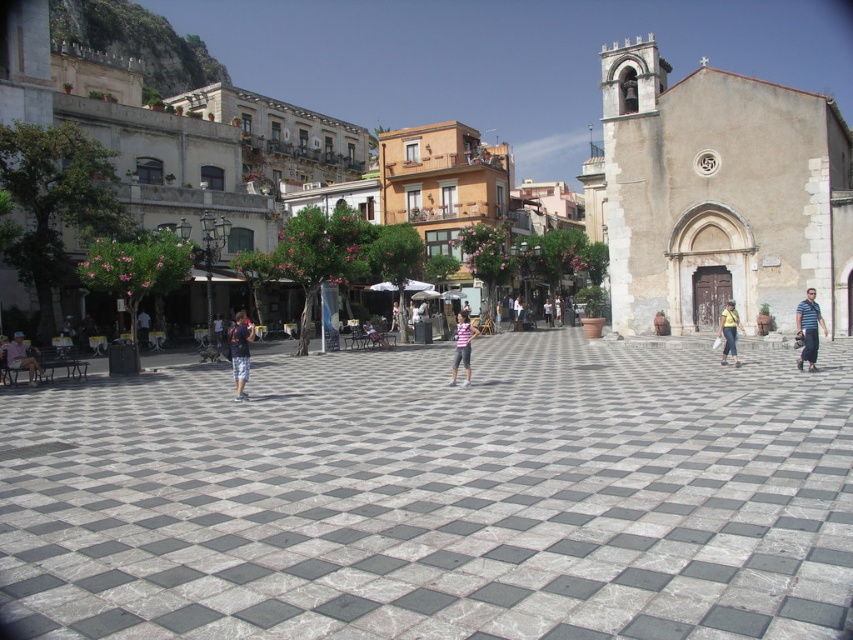
Does marble tiles at center come in front of striped fabric at center?

That is True.

Is point (4, 442) more distant than point (798, 316)?

No, it is in front of (798, 316).

Who is more distant from viewer, [248,545] or [809,326]?

Point [809,326]

The height and width of the screenshot is (640, 853). I want to click on marble tiles at center, so click(436, 499).

Who is taller, marble tiles at center or yellow fabric bag at center?

yellow fabric bag at center is taller.

Who is shorter, marble tiles at center or yellow fabric bag at center?

marble tiles at center is shorter.

Is point (416, 445) closer to viewer compared to point (733, 355)?

Yes, it is.

This screenshot has width=853, height=640. I want to click on marble tiles at center, so click(x=436, y=499).

Which is in front, point (457, 324) or point (730, 337)?

Point (730, 337) is in front.

In the scene shown: Which of these two, pink striped shirt at center or yellow fabric bag at center, stands shorter?

yellow fabric bag at center is shorter.

Describe the element at coordinates (462, 348) in the screenshot. The height and width of the screenshot is (640, 853). I see `pink striped shirt at center` at that location.

Locate an element on the screen. The height and width of the screenshot is (640, 853). pink striped shirt at center is located at coordinates (462, 348).